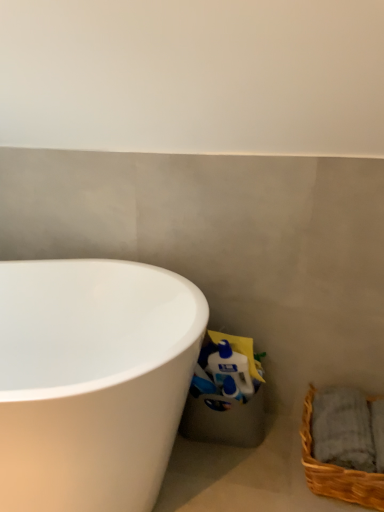
Locate an element on the screen. This screenshot has width=384, height=512. white glossy bathtub at lower left is located at coordinates (92, 381).

This screenshot has height=512, width=384. What do you see at coordinates (92, 381) in the screenshot?
I see `white glossy bathtub at lower left` at bounding box center [92, 381].

The image size is (384, 512). What do you see at coordinates (337, 471) in the screenshot?
I see `brown woven basket at lower right` at bounding box center [337, 471].

At what (x,y) coordinates should I click in order to perform the action: click on brown woven basket at lower right. Please return your answer as a coordinate pair (x, y). Image resolution: width=384 pixels, height=512 pixels. Looking at the image, I should click on (337, 471).

At what (x,y) coordinates should I click in order to perform the action: click on white glossy bathtub at lower left. Please return your answer as a coordinate pair (x, y). Image resolution: width=384 pixels, height=512 pixels. Looking at the image, I should click on (92, 381).

Consider the image. Does white glossy bathtub at lower left appear on the left side of brown woven basket at lower right?

Yes.

Is white glossy bathtub at lower left further to the viewer compared to brown woven basket at lower right?

No, white glossy bathtub at lower left is closer to the camera.

Considering the positions of point (8, 319) and point (383, 496), is point (8, 319) closer or farther from the camera than point (383, 496)?

Point (8, 319) appears to be farther away from the viewer than point (383, 496).

From the image's perspective, is white glossy bathtub at lower left above or below brown woven basket at lower right?

white glossy bathtub at lower left is situated higher than brown woven basket at lower right in the image.

From a real-world perspective, is white glossy bathtub at lower left positioned above or below brown woven basket at lower right?

From a real-world perspective, white glossy bathtub at lower left is physically above brown woven basket at lower right.

Considering the relative sizes of white glossy bathtub at lower left and brown woven basket at lower right in the image provided, is white glossy bathtub at lower left thinner than brown woven basket at lower right?

Incorrect, the width of white glossy bathtub at lower left is not less than that of brown woven basket at lower right.

Can you confirm if white glossy bathtub at lower left is shorter than brown woven basket at lower right?

Incorrect, the height of white glossy bathtub at lower left does not fall short of that of brown woven basket at lower right.

Can you confirm if white glossy bathtub at lower left is bigger than brown woven basket at lower right?

Correct, white glossy bathtub at lower left is larger in size than brown woven basket at lower right.

In the scene shown: Is brown woven basket at lower right inside white glossy bathtub at lower left?

No, brown woven basket at lower right is not inside white glossy bathtub at lower left.

Are white glossy bathtub at lower left and brown woven basket at lower right beside each other?

white glossy bathtub at lower left and brown woven basket at lower right are not in contact.

Is brown woven basket at lower right at the back of white glossy bathtub at lower left?

No, white glossy bathtub at lower left is not facing away from brown woven basket at lower right.

Locate an element on the screen. Image resolution: width=384 pixels, height=512 pixels. picnic basket on the right of white glossy bathtub at lower left is located at coordinates (337, 471).

Considering the relative positions of brown woven basket at lower right and white glossy bathtub at lower left in the image provided, is brown woven basket at lower right to the left or to the right of white glossy bathtub at lower left?

brown woven basket at lower right is to the right of white glossy bathtub at lower left.

Which is behind, brown woven basket at lower right or white glossy bathtub at lower left?

brown woven basket at lower right is further from the camera.

Does point (308, 425) lie behind point (43, 484)?

Yes, point (308, 425) is behind point (43, 484).

From the image's perspective, is brown woven basket at lower right over white glossy bathtub at lower left?

No, from the image's perspective, brown woven basket at lower right is not above white glossy bathtub at lower left.

From a real-world perspective, is brown woven basket at lower right over white glossy bathtub at lower left?

Incorrect, from a real-world perspective, brown woven basket at lower right is lower than white glossy bathtub at lower left.

Based on the photo, is brown woven basket at lower right wider than white glossy bathtub at lower left?

Incorrect, the width of brown woven basket at lower right does not surpass that of white glossy bathtub at lower left.

Based on the photo, considering the sizes of objects brown woven basket at lower right and white glossy bathtub at lower left in the image provided, who is shorter, brown woven basket at lower right or white glossy bathtub at lower left?

brown woven basket at lower right.

Is brown woven basket at lower right smaller than white glossy bathtub at lower left?

Yes.

Is brown woven basket at lower right positioned beyond the bounds of white glossy bathtub at lower left?

Yes.

Is brown woven basket at lower right next to white glossy bathtub at lower left?

No.

Could you tell me if brown woven basket at lower right is facing white glossy bathtub at lower left?

Yes, brown woven basket at lower right is oriented towards white glossy bathtub at lower left.

What's the angular difference between brown woven basket at lower right and white glossy bathtub at lower left's facing directions?

brown woven basket at lower right and white glossy bathtub at lower left are facing 113 degrees away from each other.

Find the location of a particular element. The height and width of the screenshot is (512, 384). bathtub lying in front of the brown woven basket at lower right is located at coordinates (92, 381).

The width and height of the screenshot is (384, 512). Identify the location of picnic basket behind the white glossy bathtub at lower left. (337, 471).

The width and height of the screenshot is (384, 512). Find the location of `bathtub that appears in front of the brown woven basket at lower right`. bathtub that appears in front of the brown woven basket at lower right is located at coordinates (92, 381).